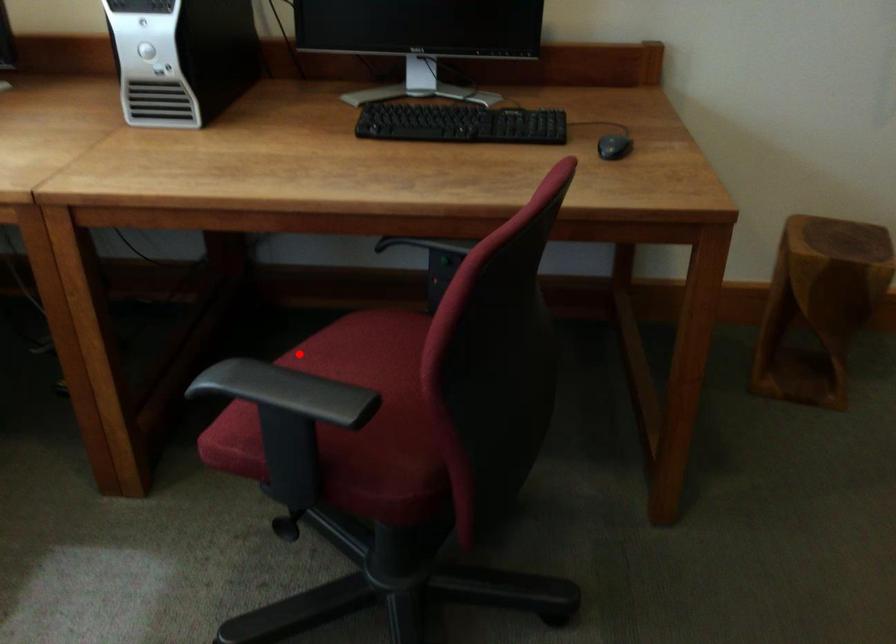
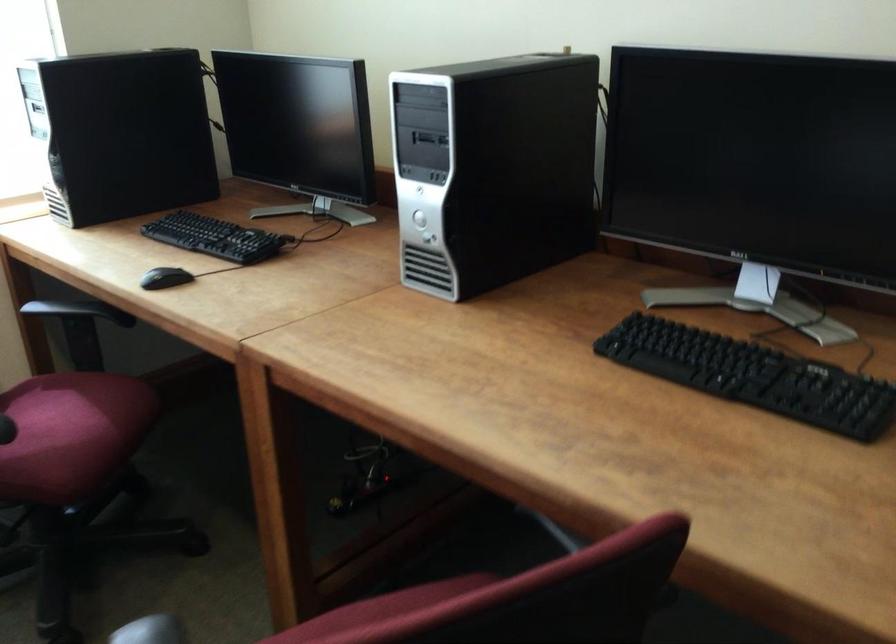
Where in the second image is the point corresponding to the highlighted location from the first image?

(381, 608)